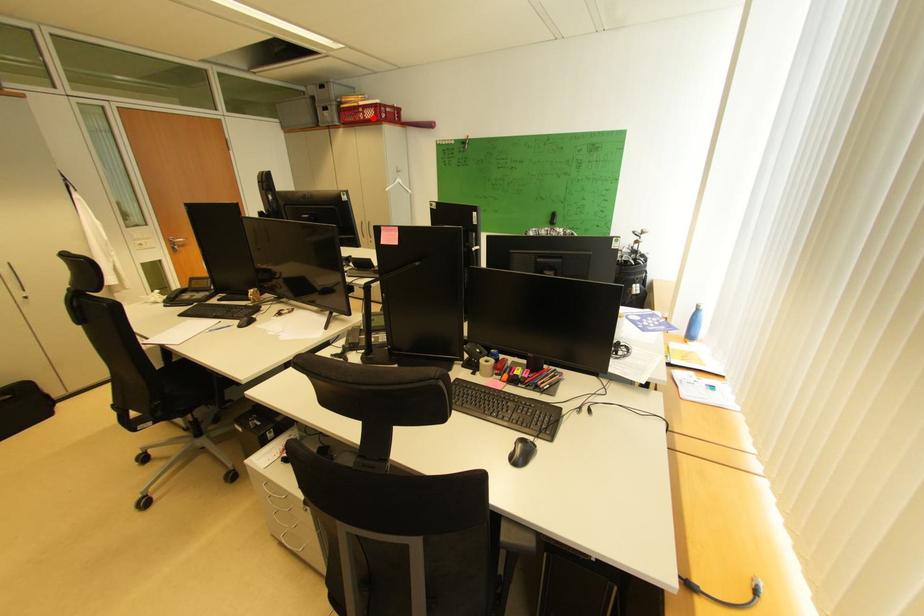
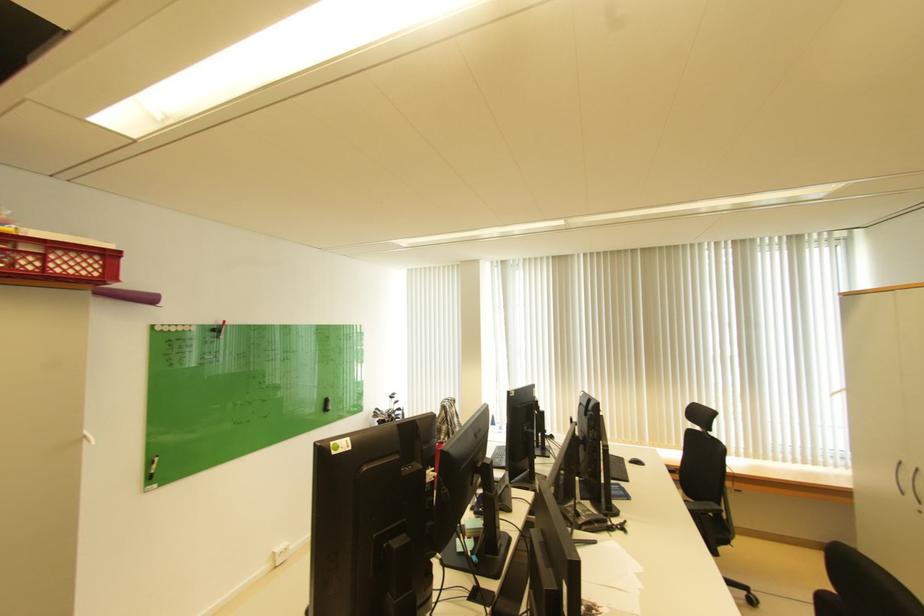
The point at the highlighted location is marked in the first image. Where is the corresponding point in the second image?

(54, 268)